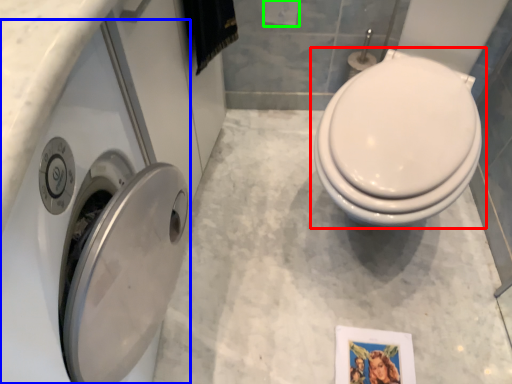
Question: Considering the real-world distances, which object is closest to toilet (highlighted by a red box)? washer (highlighted by a blue box) or toilet paper (highlighted by a green box).

Choices:
 (A) washer
 (B) toilet paper

Answer: (A)